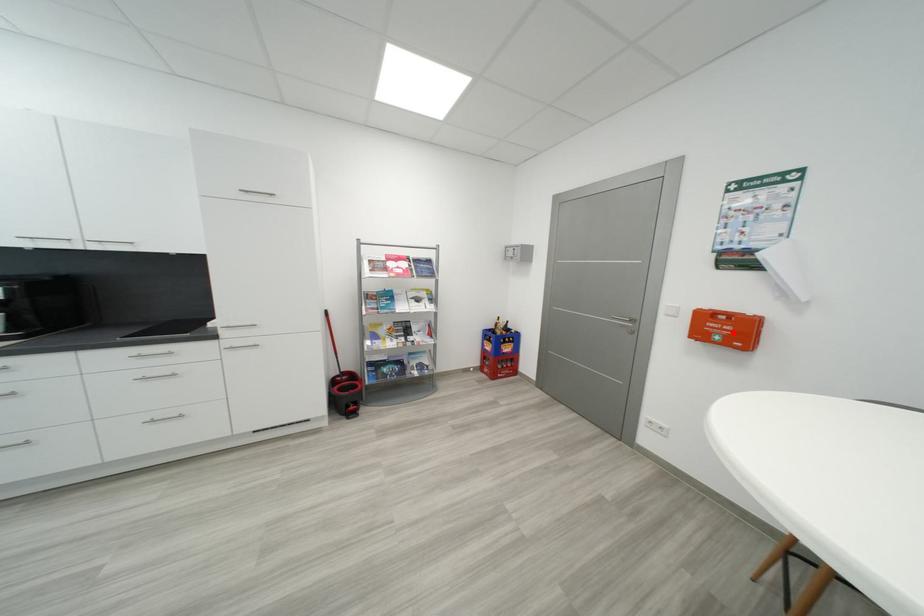
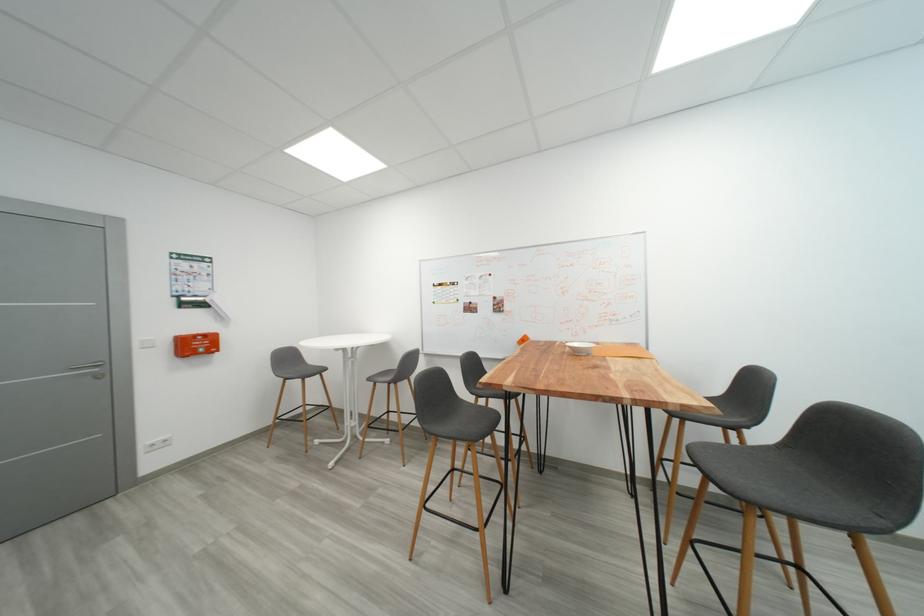
Where in the second image is the point corresponding to the highlighted location from the first image?

(203, 347)